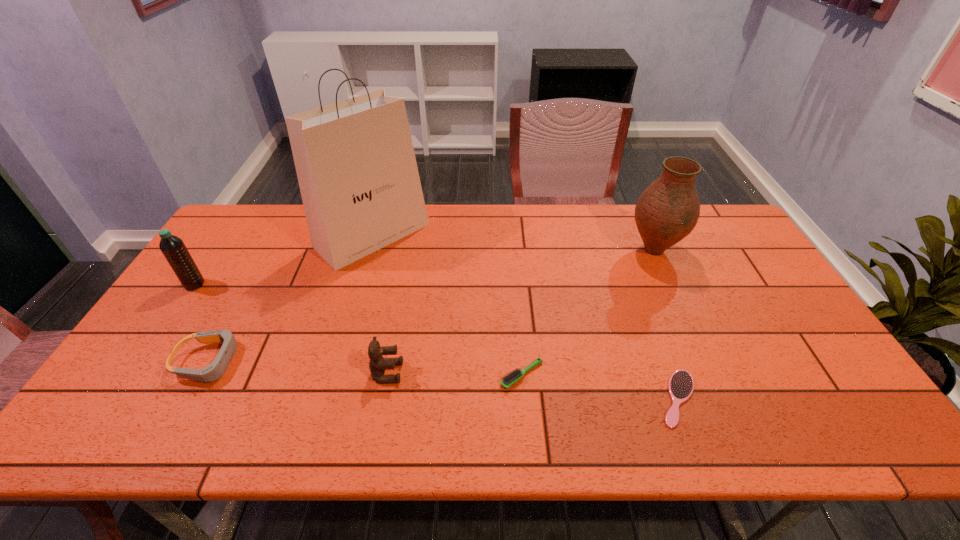
I want to click on goggles that is at the left edge, so click(x=212, y=372).

This screenshot has width=960, height=540. In the image, there is a desktop. Find the location of `free space at the far edge`. free space at the far edge is located at coordinates (522, 207).

The height and width of the screenshot is (540, 960). In the image, there is a desktop. In order to click on free space at the near edge in this screenshot , I will do `click(594, 413)`.

In the image, there is a desktop. Where is `vacant space at the left edge`? vacant space at the left edge is located at coordinates (239, 266).

This screenshot has width=960, height=540. In order to click on vacant space at the right edge of the desktop in this screenshot , I will do `click(762, 324)`.

This screenshot has width=960, height=540. Identify the location of vacant space at the far right corner. (727, 216).

This screenshot has width=960, height=540. Identify the location of vacant space that's between the goggles and the right hairbrush. (444, 380).

Identify the location of vacant region between the sixth object from right to left and the fifth object from left to right. (366, 368).

Identify the location of vacant area that lies between the tallest object and the teddy bear. (380, 304).

The width and height of the screenshot is (960, 540). I want to click on unoccupied position between the sixth shortest object and the teddy bear, so click(520, 311).